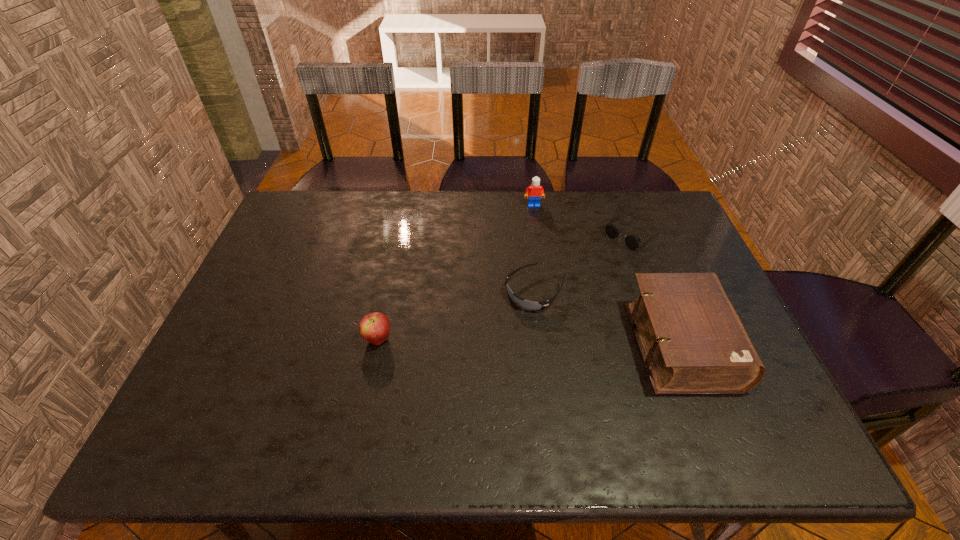
Find the location of a particular element. The height and width of the screenshot is (540, 960). vacant space that's between the Lego and the Bible is located at coordinates (608, 275).

Identify the location of free space between the farther sunglasses and the left sunglasses. (584, 262).

Image resolution: width=960 pixels, height=540 pixels. In order to click on vacant area that lies between the apple and the fourth nearest object in this screenshot , I will do `click(505, 286)`.

The height and width of the screenshot is (540, 960). In order to click on free spot between the leftmost object and the left sunglasses in this screenshot , I will do `click(456, 315)`.

The height and width of the screenshot is (540, 960). I want to click on empty space that is in between the Lego and the Bible, so click(x=608, y=275).

Where is `unoccupied area between the leftmost object and the Bible`? The height and width of the screenshot is (540, 960). unoccupied area between the leftmost object and the Bible is located at coordinates (530, 342).

What are the coordinates of `free space that is in between the left sunglasses and the Bible` in the screenshot? It's located at (608, 318).

Where is `empty space between the Lego and the fourth nearest object`? The width and height of the screenshot is (960, 540). empty space between the Lego and the fourth nearest object is located at coordinates (583, 219).

Identify the location of free space between the leftmost object and the farther sunglasses. Image resolution: width=960 pixels, height=540 pixels. (505, 286).

Identify which object is the third nearest to the farthest object. Please provide its 2D coordinates. Your answer should be formatted as a tuple, i.e. [(x, y)], where the tuple contains the x and y coordinates of a point satisfying the conditions above.

[(692, 341)]